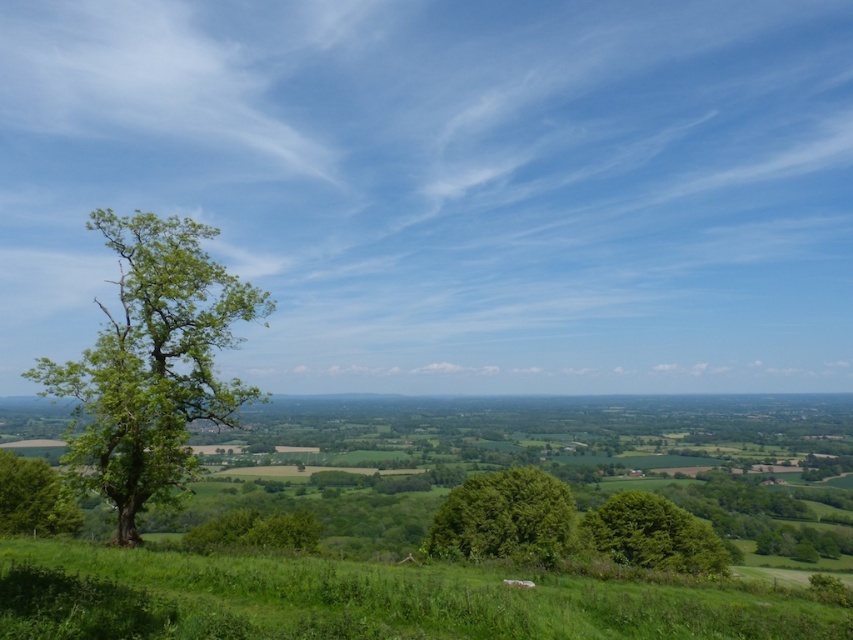
Does green leafy tree at center appear over green leafy tree at lower left?

Actually, green leafy tree at center is below green leafy tree at lower left.

Is point (463, 486) in front of point (49, 524)?

No.

Between point (541, 502) and point (24, 477), which one is positioned behind?

Point (541, 502)

The image size is (853, 640). I want to click on green leafy tree at center, so click(503, 516).

Is point (177, 474) positioned after point (622, 532)?

No, (177, 474) is closer to viewer.

Locate an element on the screen. green leafy tree at left is located at coordinates 152,364.

Does green grassy field at lower center appear on the left side of green leafy tree at left?

In fact, green grassy field at lower center is to the right of green leafy tree at left.

Identify the location of green grassy field at lower center. (363, 600).